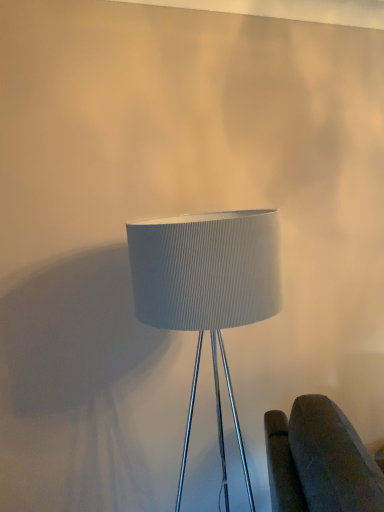
Question: Should I look upward or downward to see white ribbed fabric lampshade at center?

Choices:
 (A) down
 (B) up

Answer: (A)